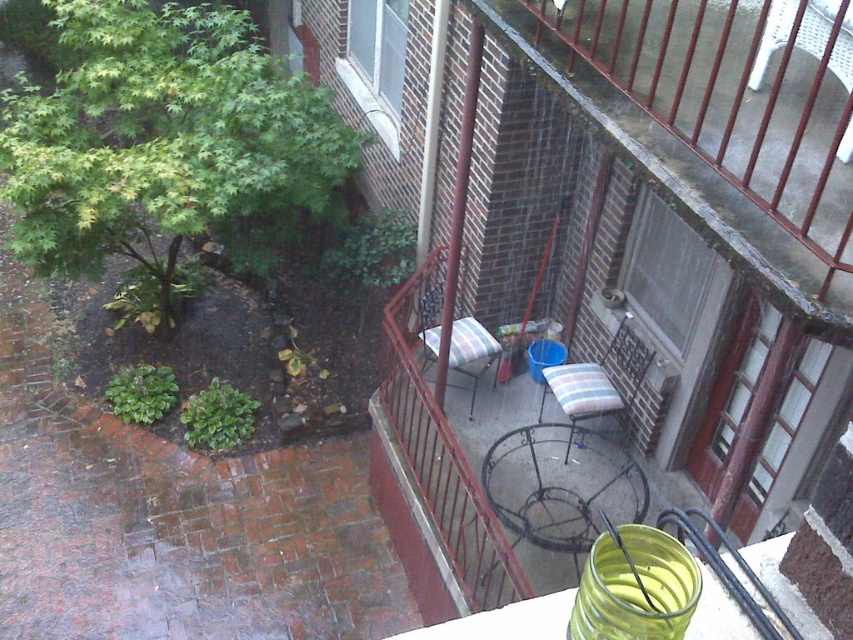
Question: Considering the real-world distances, which object is farthest from the rusty metal railing at center?

Choices:
 (A) striped fabric chairs at center
 (B) green leafy tree at left

Answer: (A)

Question: Which object is closer to the camera taking this photo?

Choices:
 (A) rusty metal railing at center
 (B) striped fabric cushion at lower right
 (C) green leafy tree at left

Answer: (A)

Question: Does rusty metal railing at center appear on the right side of striped fabric chair at center?

Choices:
 (A) no
 (B) yes

Answer: (A)

Question: Is striped fabric cushion at lower right wider than striped fabric chair at center?

Choices:
 (A) yes
 (B) no

Answer: (B)

Question: Which point is closer to the camera?

Choices:
 (A) (463, 355)
 (B) (447, 520)

Answer: (B)

Question: Is green leafy tree at left to the left of striped fabric chair at center from the viewer's perspective?

Choices:
 (A) yes
 (B) no

Answer: (A)